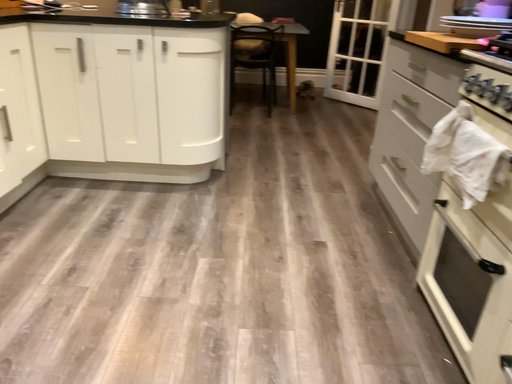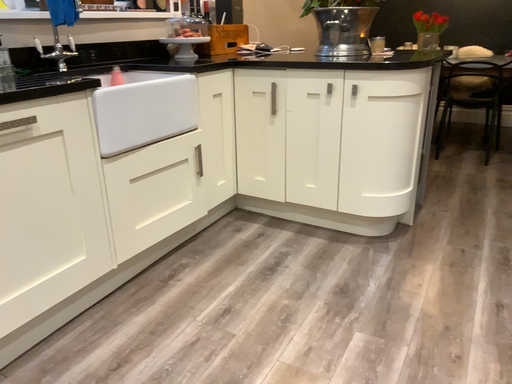
Question: How did the camera likely rotate when shooting the video?

Choices:
 (A) rotated downward
 (B) rotated upward

Answer: (B)